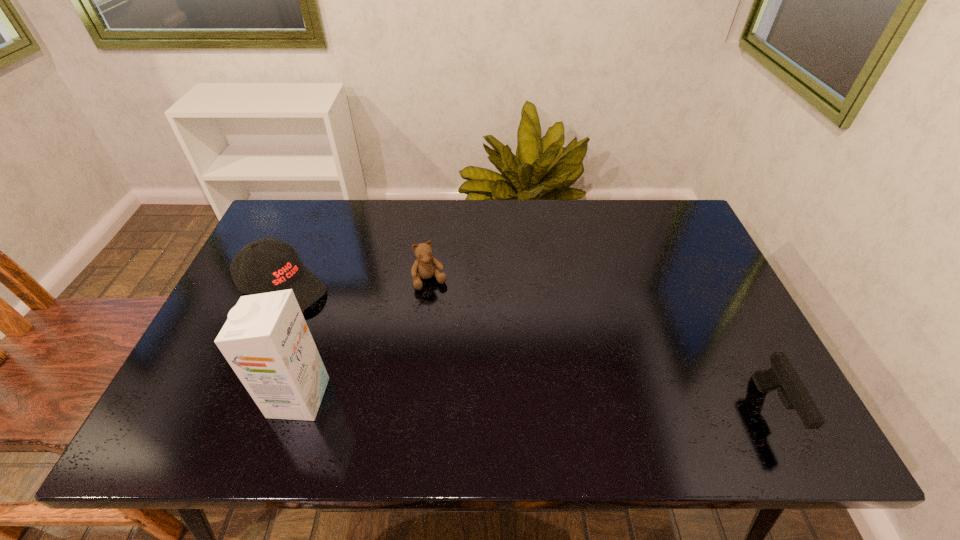
Find the location of a particular element. This screenshot has width=960, height=540. free space between the rightmost object and the third object from left to right is located at coordinates (601, 345).

Identify the location of object that is the second closest to the baseball cap. This screenshot has height=540, width=960. (425, 266).

You are a GUI agent. You are given a task and a screenshot of the screen. Output one action in this format:
    pyautogui.click(x=<x>, y=<y>)
    Task: Click on the closest object to the carton
    The image size is (960, 540).
    Given the screenshot: What is the action you would take?
    point(282,269)

Find the location of `free space that satisfies the following two spatial constraints: 1. on the back side of the carton; 2. on the left side of the second object from right to left`. free space that satisfies the following two spatial constraints: 1. on the back side of the carton; 2. on the left side of the second object from right to left is located at coordinates (337, 280).